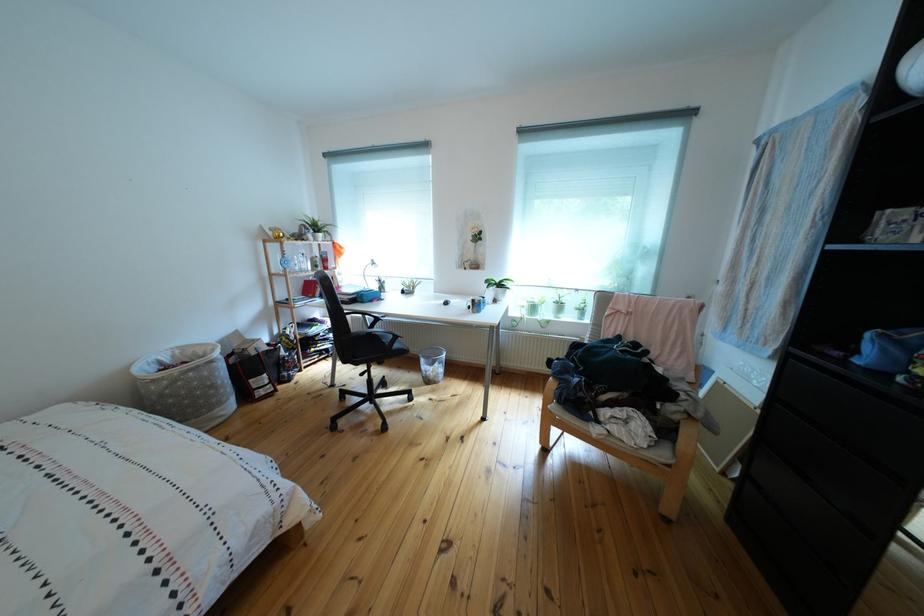
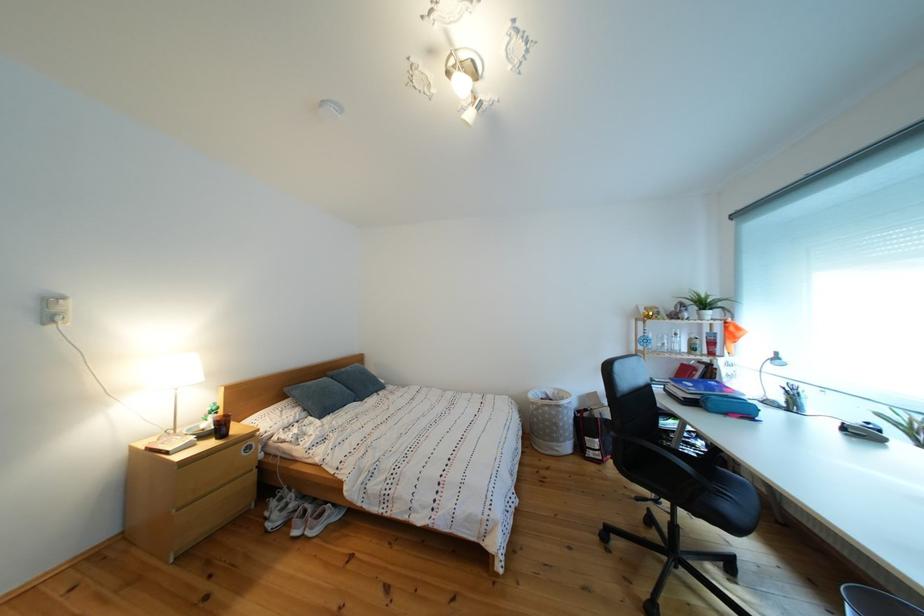
Question: The first image is from the beginning of the video and the second image is from the end. How did the camera likely rotate when shooting the video?

Choices:
 (A) Left
 (B) Right
 (C) Up
 (D) Down

Answer: (A)